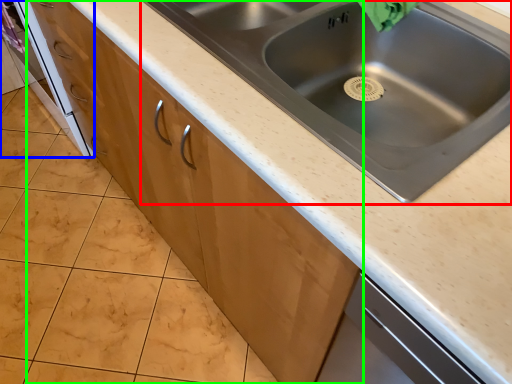
Question: Which object is positioned farthest from sink (highlighted by a red box)? Select from oven (highlighted by a blue box) and cabinetry (highlighted by a green box).

Choices:
 (A) oven
 (B) cabinetry

Answer: (A)